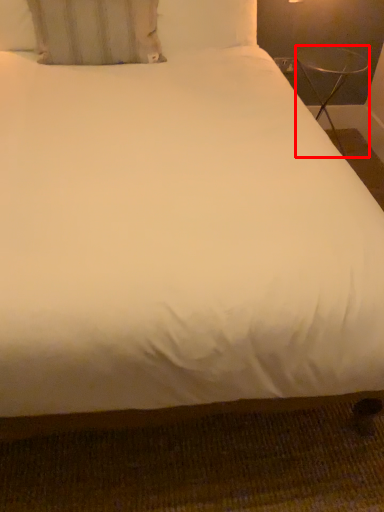
Question: From the image's perspective, where is table (annotated by the red box) located in relation to pillow in the image?

Choices:
 (A) above
 (B) below

Answer: (B)